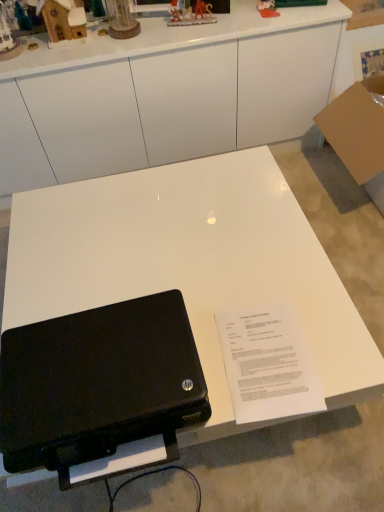
At what (x,y) coordinates should I click in order to perform the action: click on free location in front of metallic silver sleigh at upper center, placed as the second toy when sorted from right to left. Please return your answer as a coordinate pair (x, y). Looking at the image, I should click on (189, 33).